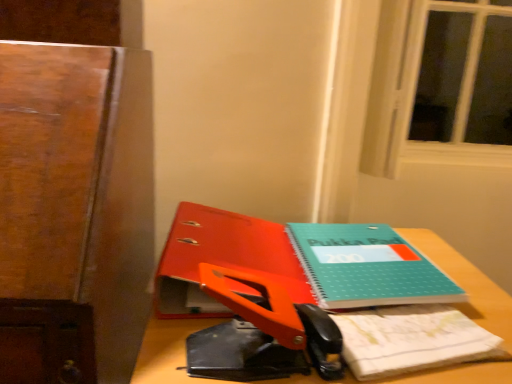
Question: Is teal matte notepad at center spatially inside orange plastic scissors at center, or outside of it?

Choices:
 (A) outside
 (B) inside

Answer: (A)

Question: From a real-world perspective, is teal matte notepad at center physically located above or below orange plastic scissors at center?

Choices:
 (A) below
 (B) above

Answer: (A)

Question: Which is nearer to the teal matte notebook at center?

Choices:
 (A) orange plastic scissors at center
 (B) wooden desk at center
 (C) teal matte notebook at center
 (D) teal matte notepad at center

Answer: (A)

Question: Considering the real-world distances, which object is farthest from the teal matte notebook at center?

Choices:
 (A) teal matte notepad at center
 (B) orange plastic scissors at center
 (C) wooden desk at center
 (D) teal matte notebook at center

Answer: (B)